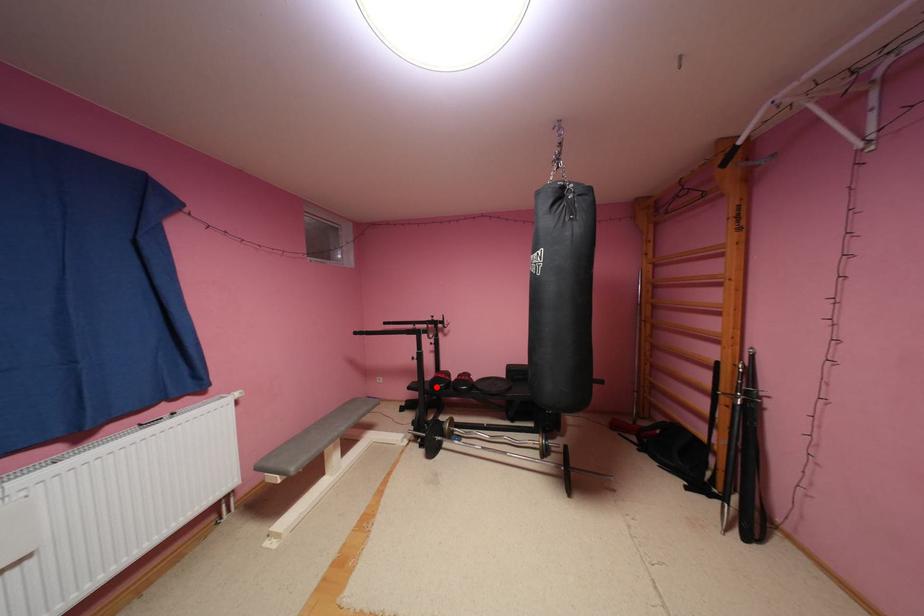
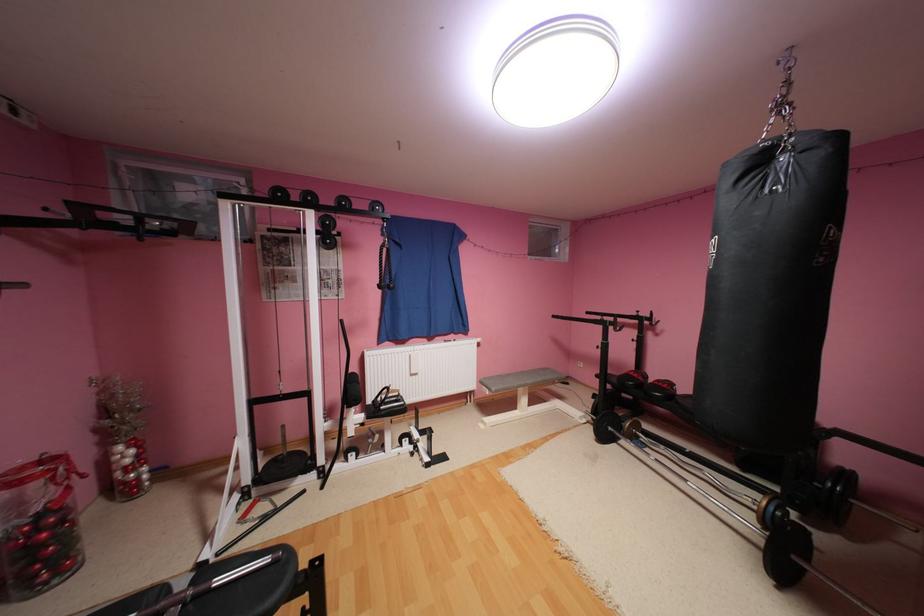
Question: I am providing you with two images of the same scene from different viewpoints. A red point is marked on the first image. Is the red point's position out of view in image 2?

Choices:
 (A) Yes
 (B) No

Answer: (B)